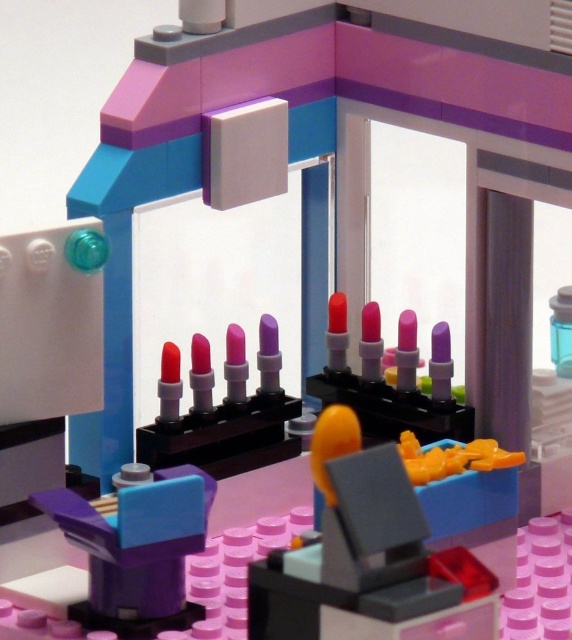
Question: Which point is farther to the camera?

Choices:
 (A) (225, 465)
 (B) (434, 566)

Answer: (A)

Question: From the image, what is the correct spatial relationship of purple matte box at lower left in relation to matte plastic lipsticks at center?

Choices:
 (A) below
 (B) above

Answer: (A)

Question: Is orange plastic chair at center closer to camera compared to purple matte box at lower left?

Choices:
 (A) no
 (B) yes

Answer: (B)

Question: Considering the relative positions of orange plastic chair at center and matte plastic lipsticks at center in the image provided, where is orange plastic chair at center located with respect to matte plastic lipsticks at center?

Choices:
 (A) right
 (B) left

Answer: (A)

Question: Which object is the closest to the purple matte box at lower left?

Choices:
 (A) transparent plastic bottle at upper right
 (B) orange plastic chair at center

Answer: (B)

Question: Which of the following is the farthest from the observer?

Choices:
 (A) (375, 416)
 (B) (387, 492)
 (C) (200, 458)
 (D) (81, 620)

Answer: (A)